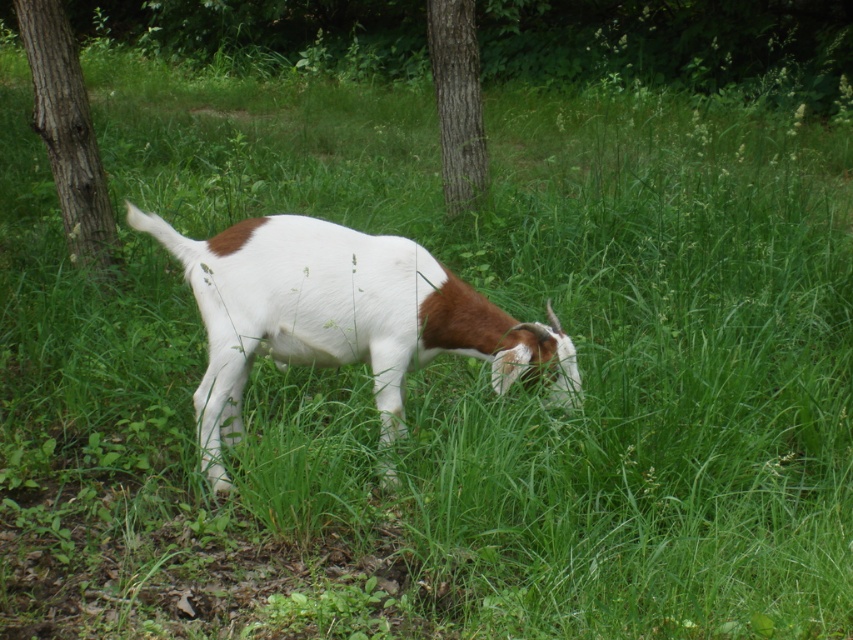
Question: Does brown rough bark at left have a smaller size compared to brown rough bark tree at center?

Choices:
 (A) no
 (B) yes

Answer: (A)

Question: Can you confirm if white soft fur goat at center is wider than brown rough bark at left?

Choices:
 (A) no
 (B) yes

Answer: (B)

Question: Which object is the farthest from the white soft fur goat at center?

Choices:
 (A) brown rough bark tree at center
 (B) brown rough bark at left

Answer: (A)

Question: Is brown rough bark at left positioned before brown rough bark tree at center?

Choices:
 (A) yes
 (B) no

Answer: (A)

Question: Among these objects, which one is farthest from the camera?

Choices:
 (A) brown rough bark at left
 (B) white soft fur goat at center

Answer: (A)

Question: Estimate the real-world distances between objects in this image. Which object is closer to the brown rough bark at left?

Choices:
 (A) white soft fur goat at center
 (B) brown rough bark tree at center

Answer: (A)